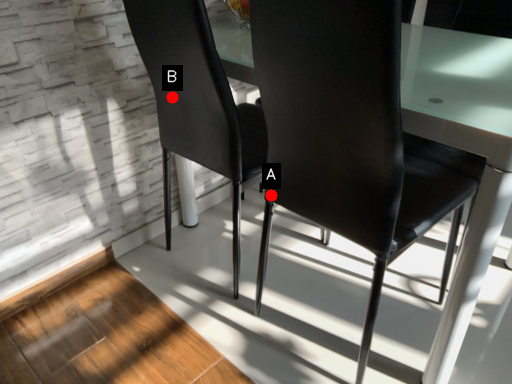
Question: Two points are circled on the image, labeled by A and B beside each circle. Which point appears closest to the camera in this image?

Choices:
 (A) A is closer
 (B) B is closer

Answer: (A)